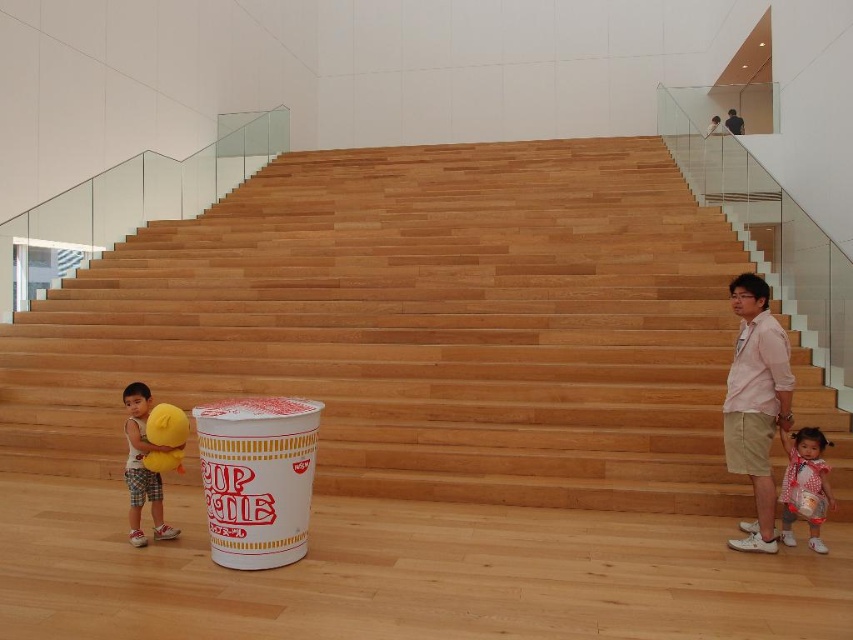
You are a photographer setting up a shoot in the described scene. You need to place a small tripod between the white polka dot dress at lower right and the matte yellow plush toy at lower left. Based on their widths, which object should the tripod be closer to to ensure stability?

Result: The white polka dot dress at lower right has a lesser width compared to the matte yellow plush toy at lower left. To ensure stability, the tripod should be placed closer to the wider matte yellow plush toy at lower left.

You are a delivery person carrying a large box that is 1.5 meters wide. You need to walk up the wooden stairs at center to deliver the box to the second floor. Can you pass through the staircase without any issues?

The wooden stairs at center are 4.58 meters away from the camera, but the question is about the width of the staircase. Since the description only provides the distance from the camera and not the width, it is impossible to determine if the 1.5 meter wide box can fit. More information about the staircase width is needed.

You are a parent trying to ensure your child stays safe while playing. The child is near the wooden stairs at center and the matte yellow plush toy at lower left. Based on their positions, which object is closer to the staircase?

The wooden stairs at center is to the right of matte yellow plush toy at lower left, so the matte yellow plush toy at lower left is closer to the staircase.